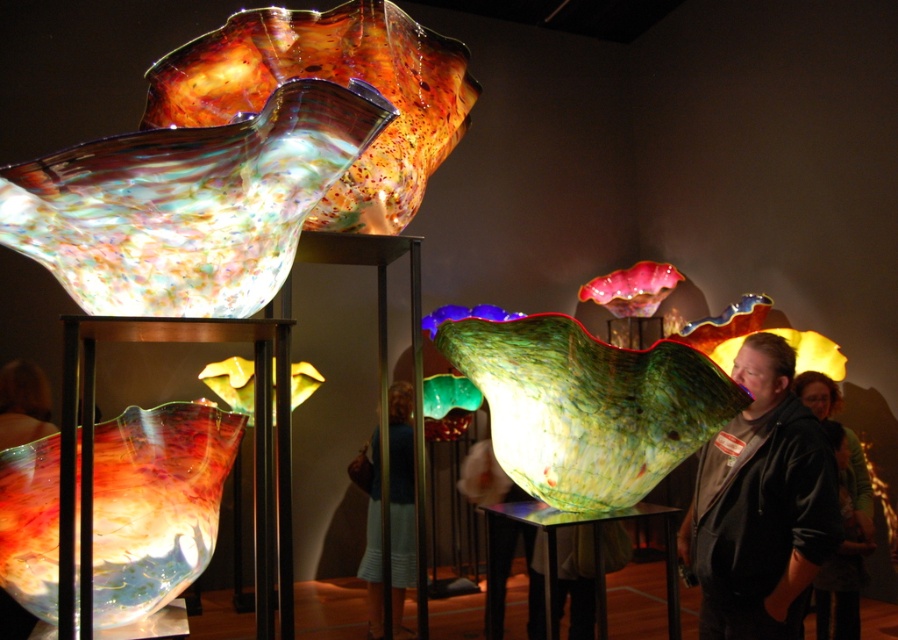
Question: Which object appears closest to the camera in this image?

Choices:
 (A) matte black jacket at right
 (B) dark brown leather jacket at lower right
 (C) translucent multicolored glass at left
 (D) multicolored glass sculpture at upper left

Answer: (D)

Question: Can you confirm if multicolored glass sculpture at upper left is wider than blue fabric dress at center?

Choices:
 (A) no
 (B) yes

Answer: (B)

Question: Which object appears closest to the camera in this image?

Choices:
 (A) matte black jacket at right
 (B) dark brown leather jacket at lower right

Answer: (A)

Question: Is blue fabric dress at center wider than dark brown leather jacket at lower right?

Choices:
 (A) yes
 (B) no

Answer: (A)

Question: Which point is farther to the camera?

Choices:
 (A) translucent multicolored glass at left
 (B) multicolored glass sculpture at upper left
 (C) matte black jacket at right
 (D) blue fabric dress at center

Answer: (D)

Question: Can you confirm if multicolored glass sculpture at upper left is smaller than translucent multicolored glass at left?

Choices:
 (A) yes
 (B) no

Answer: (B)